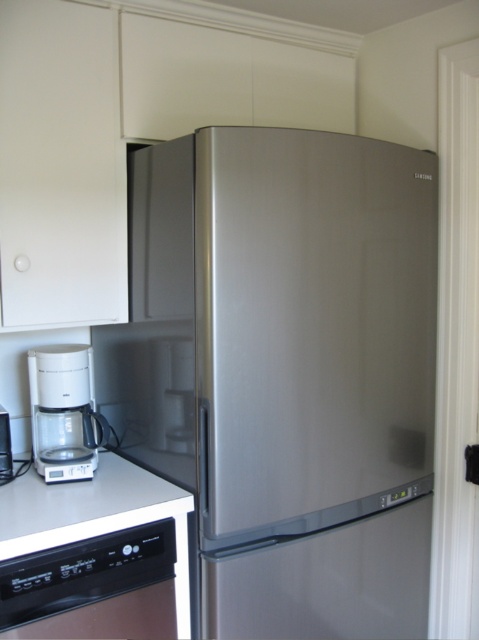
Does stainless steel refrigerator at center come in front of white glossy countertop at lower left?

No.

Does stainless steel refrigerator at center appear over white glossy countertop at lower left?

Correct, stainless steel refrigerator at center is located above white glossy countertop at lower left.

Locate an element on the screen. The width and height of the screenshot is (479, 640). stainless steel refrigerator at center is located at coordinates (285, 371).

Where is `stainless steel refrigerator at center`? stainless steel refrigerator at center is located at coordinates coord(285,371).

Does stainless steel refrigerator at center come in front of white plastic coffee maker at lower left?

Yes, it is.

This screenshot has height=640, width=479. In order to click on stainless steel refrigerator at center in this screenshot , I will do `click(285, 371)`.

Does black glossy oven at lower left have a greater width compared to white glossy countertop at lower left?

No, black glossy oven at lower left is not wider than white glossy countertop at lower left.

Is point (120, 534) more distant than point (113, 484)?

No, it is in front of (113, 484).

Who is more distant from viewer, (91, 582) or (134, 493)?

The point (134, 493) is behind.

Where is `black glossy oven at lower left`? This screenshot has height=640, width=479. black glossy oven at lower left is located at coordinates pos(90,584).